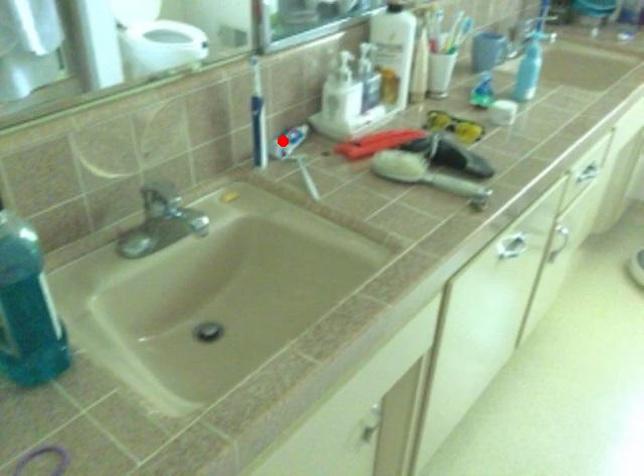
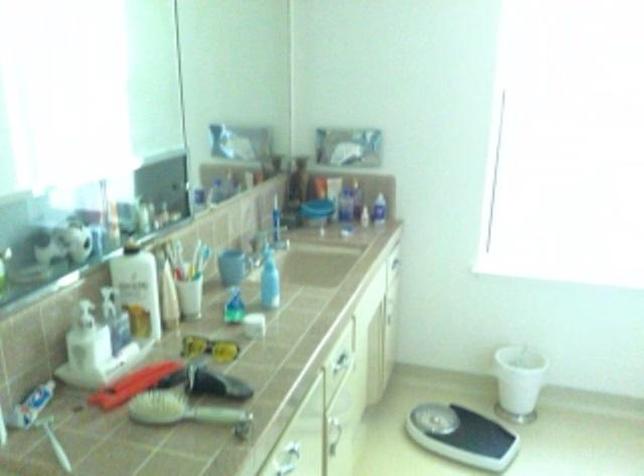
The point at the highlighted location is marked in the first image. Where is the corresponding point in the second image?

(31, 406)